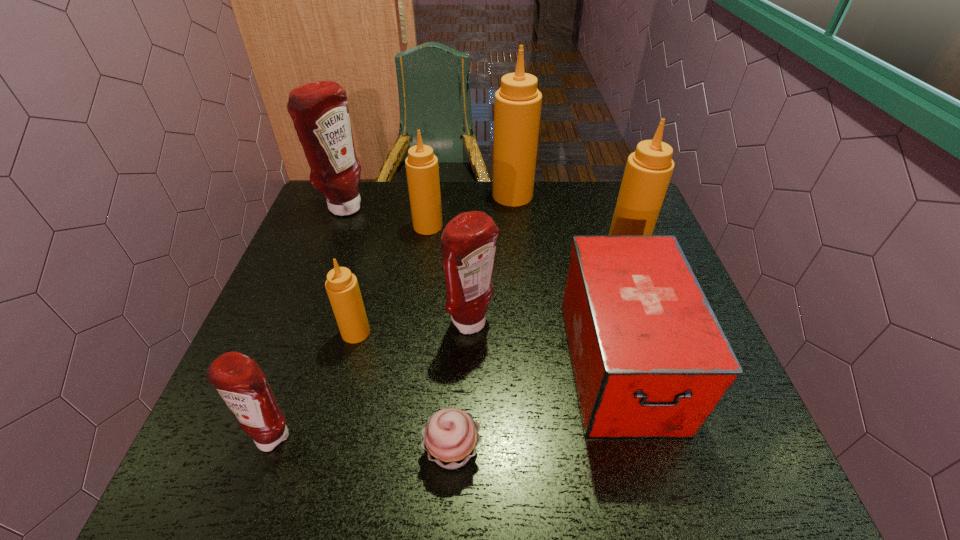
Where is `object that is at the near left corner`? The image size is (960, 540). object that is at the near left corner is located at coordinates (241, 383).

This screenshot has height=540, width=960. In order to click on vacant space at the far edge of the desktop in this screenshot , I will do pos(464,193).

Where is `vacant area at the near edge`? Image resolution: width=960 pixels, height=540 pixels. vacant area at the near edge is located at coordinates (660, 460).

In the image, there is a desktop. Where is `blank space at the far right corner`? The width and height of the screenshot is (960, 540). blank space at the far right corner is located at coordinates (607, 197).

Locate an element on the screen. free space at the near right corner of the desktop is located at coordinates (758, 444).

Where is `free space between the rightmost tan condiment and the fifth condiment from left to right`? The width and height of the screenshot is (960, 540). free space between the rightmost tan condiment and the fifth condiment from left to right is located at coordinates (549, 286).

Locate an element on the screen. This screenshot has height=540, width=960. free space between the pink cupcake and the fourth condiment from left to right is located at coordinates (441, 339).

The image size is (960, 540). What are the coordinates of `vacant point located between the second biggest red condiment and the pink cupcake` in the screenshot? It's located at (462, 387).

Locate an element on the screen. The image size is (960, 540). free point between the pink cupcake and the smallest tan condiment is located at coordinates (404, 392).

Image resolution: width=960 pixels, height=540 pixels. I want to click on free space that is in between the sixth object from right to left and the tallest object, so click(470, 211).